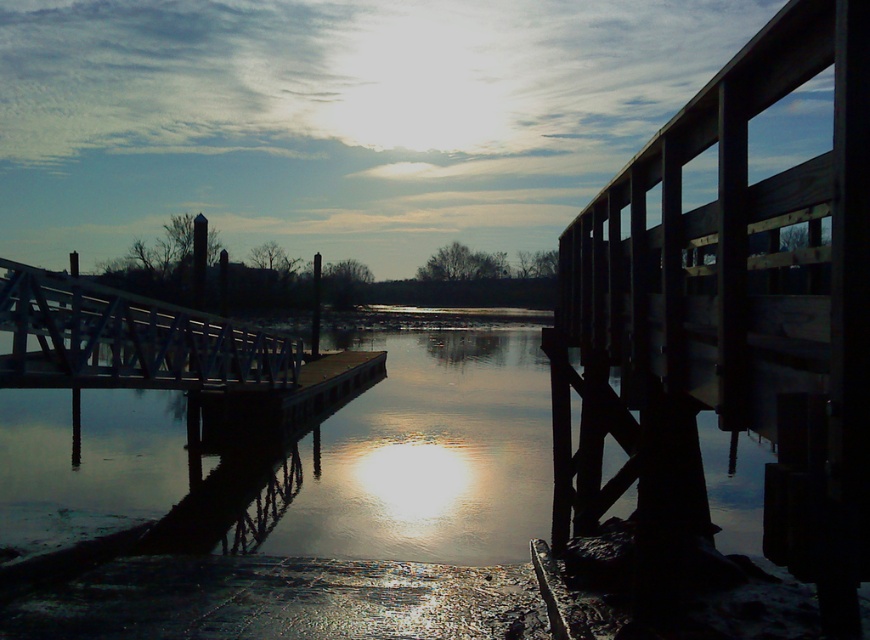
Question: Is wooden rail at right bigger than white metal bridge at left?

Choices:
 (A) yes
 (B) no

Answer: (A)

Question: Among these points, which one is nearest to the camera?

Choices:
 (A) (148, 352)
 (B) (574, 227)

Answer: (B)

Question: Which point is closer to the camera?

Choices:
 (A) (23, 324)
 (B) (720, 108)

Answer: (B)

Question: Is wooden rail at right closer to camera compared to white metal bridge at left?

Choices:
 (A) yes
 (B) no

Answer: (A)

Question: Can you confirm if wooden rail at right is smaller than white metal bridge at left?

Choices:
 (A) yes
 (B) no

Answer: (B)